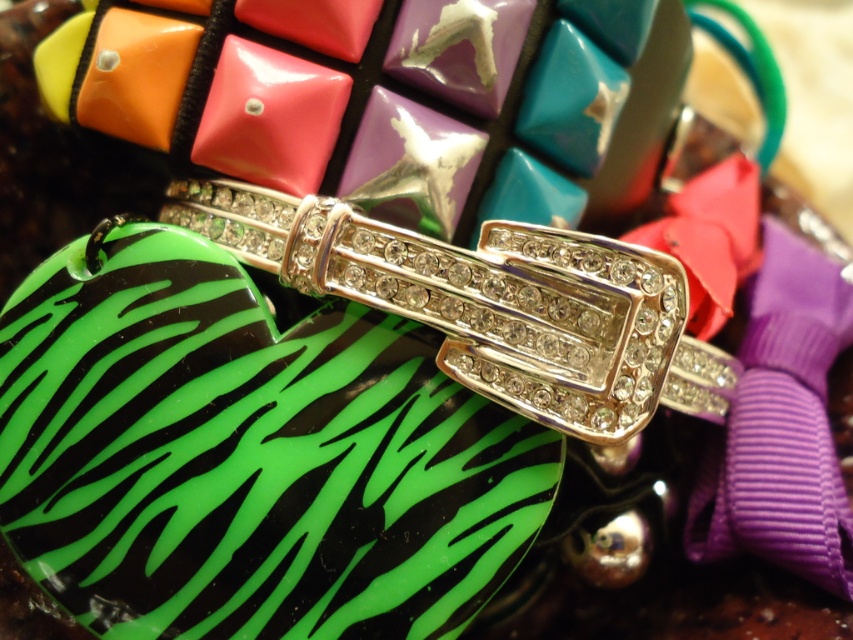
Can you confirm if gold plated rhinestone ring at center is positioned above matte pink ribbon at center?

Incorrect, gold plated rhinestone ring at center is not positioned above matte pink ribbon at center.

Does gold plated rhinestone ring at center appear on the right side of matte pink ribbon at center?

No, gold plated rhinestone ring at center is not to the right of matte pink ribbon at center.

Which is behind, point (223, 216) or point (695, 262)?

The point (695, 262) is more distant.

Identify the location of gold plated rhinestone ring at center. (477, 298).